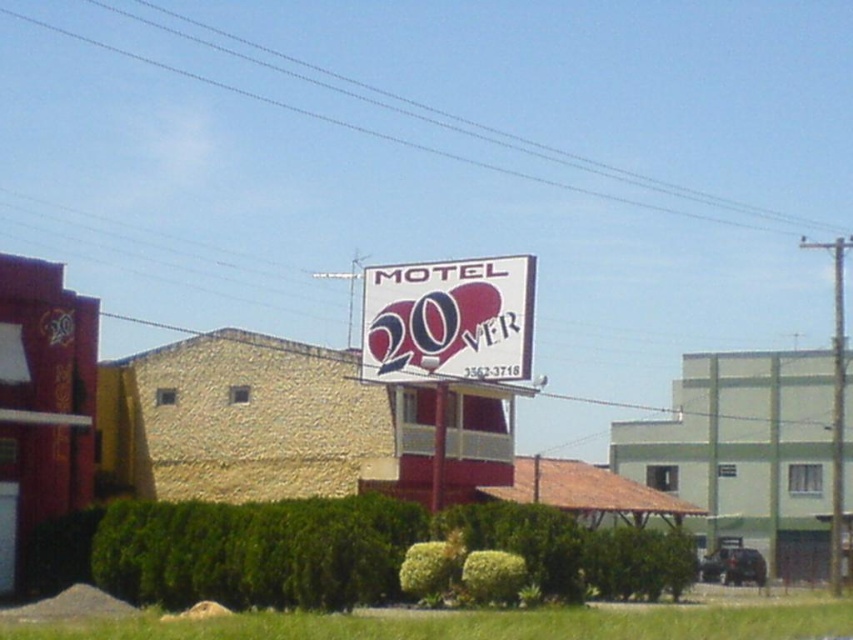
Question: Is white plastic sign at center to the left of white plastic pole at center from the viewer's perspective?

Choices:
 (A) no
 (B) yes

Answer: (A)

Question: Is white plastic sign at center above white plastic pole at center?

Choices:
 (A) no
 (B) yes

Answer: (B)

Question: Does white plastic sign at center appear under white plastic pole at center?

Choices:
 (A) no
 (B) yes

Answer: (A)

Question: Which point appears farthest from the camera in this image?

Choices:
 (A) (440, 452)
 (B) (422, 349)

Answer: (B)

Question: Among these objects, which one is nearest to the camera?

Choices:
 (A) white plastic sign at center
 (B) white plastic pole at center

Answer: (A)